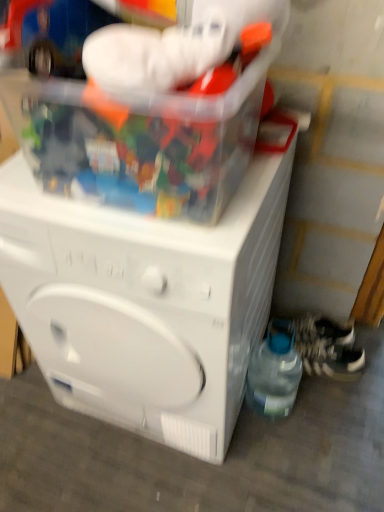
Locate an element on the screen. free space in front of white plastic washing machine at center is located at coordinates (169, 473).